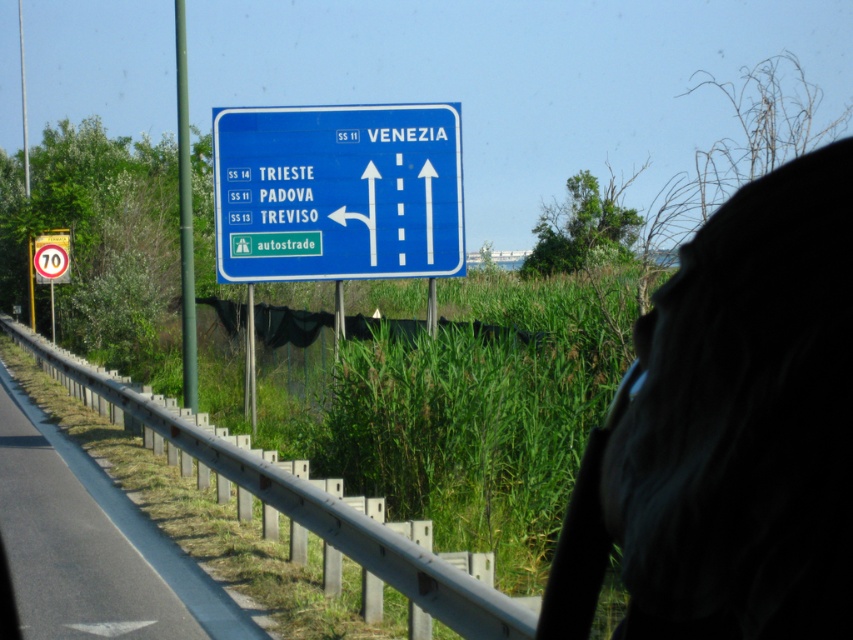
Can you confirm if blue plastic sign at upper center is wider than yellow reflective speed limit sign at upper left?

Yes, blue plastic sign at upper center is wider than yellow reflective speed limit sign at upper left.

Locate an element on the screen. The image size is (853, 640). blue plastic sign at upper center is located at coordinates pyautogui.click(x=337, y=193).

Is point (387, 129) closer to camera compared to point (62, 253)?

Yes.

Image resolution: width=853 pixels, height=640 pixels. In order to click on blue plastic sign at upper center in this screenshot , I will do point(337,193).

Who is higher up, dark fabric scarf at upper right or metallic gray guardrail at lower left?

dark fabric scarf at upper right is above.

Does dark fabric scarf at upper right have a larger size compared to metallic gray guardrail at lower left?

Incorrect, dark fabric scarf at upper right is not larger than metallic gray guardrail at lower left.

Does point (807, 372) come in front of point (109, 481)?

That is True.

This screenshot has height=640, width=853. Find the location of `dark fabric scarf at upper right`. dark fabric scarf at upper right is located at coordinates (730, 432).

Is metallic gray guardrail at lower left positioned at the back of yellow reflective speed limit sign at upper left?

No, metallic gray guardrail at lower left is in front of yellow reflective speed limit sign at upper left.

Is point (73, 444) less distant than point (44, 275)?

Yes, point (73, 444) is closer to viewer.

You are a GUI agent. You are given a task and a screenshot of the screen. Output one action in this format:
    pyautogui.click(x=<x>, y=<y>)
    Task: Click on the metallic gray guardrail at lower left
    Image resolution: width=853 pixels, height=640 pixels.
    Given the screenshot: What is the action you would take?
    pyautogui.click(x=144, y=532)

The height and width of the screenshot is (640, 853). I want to click on metallic gray guardrail at lower left, so click(144, 532).